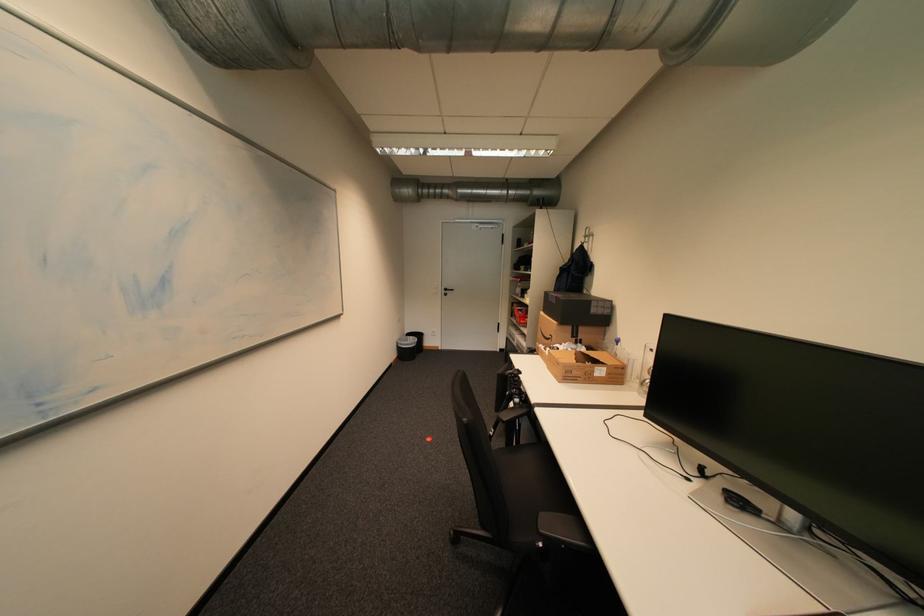
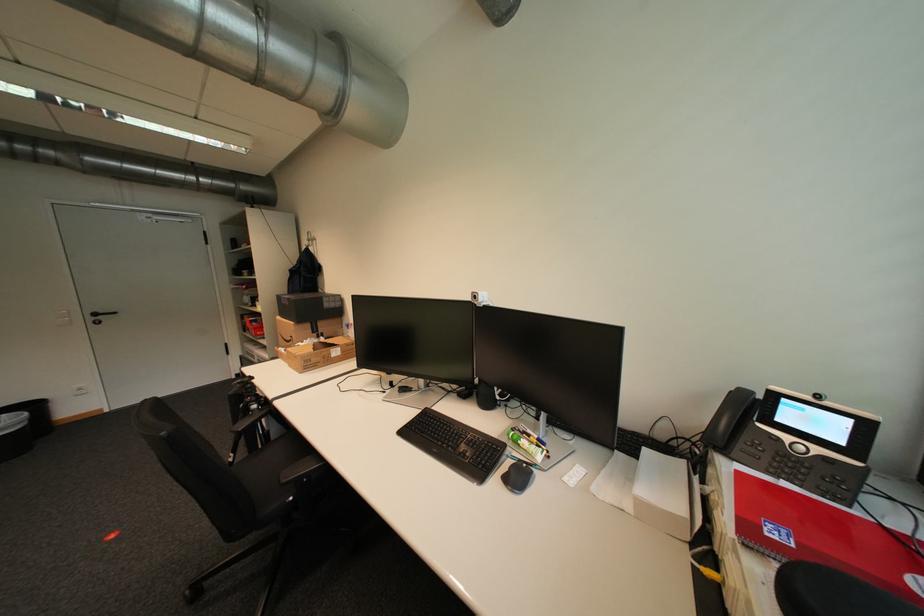
Where in the second image is the point corresponding to [419,338] from the first image?

(11, 416)